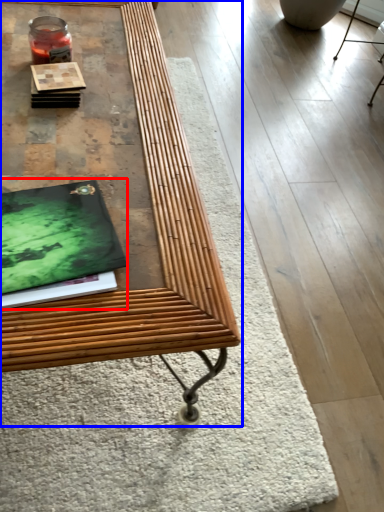
Question: Which point is further to the camera, magazine (highlighted by a red box) or table (highlighted by a blue box)?

Choices:
 (A) magazine
 (B) table

Answer: (A)